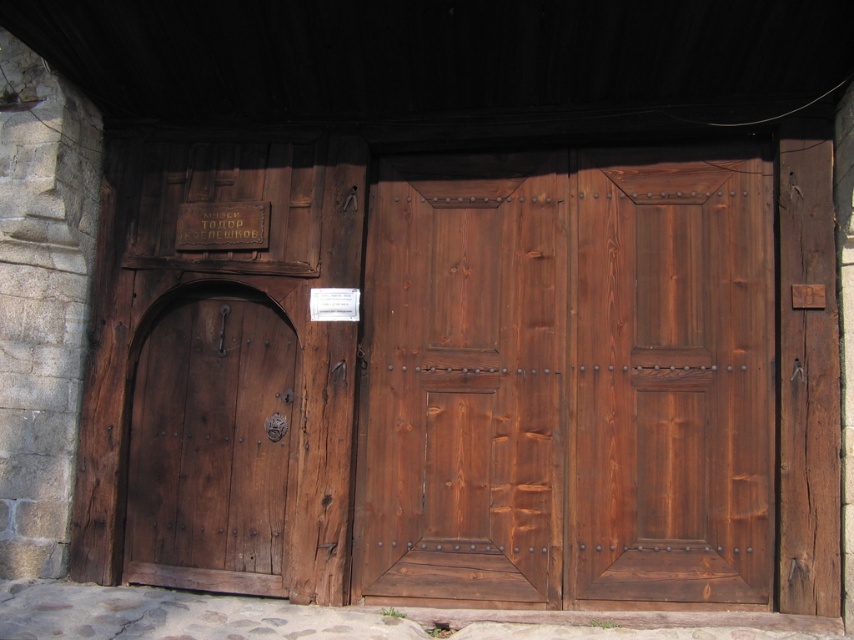
Which is behind, point (568, 260) or point (197, 516)?

Point (197, 516)

Where is `stained wood door at center`? stained wood door at center is located at coordinates (568, 380).

Is satin brown wood door at center positioned at the back of satin wood door at center?

No, it is not.

Does satin brown wood door at center have a greater width compared to satin wood door at center?

Incorrect, satin brown wood door at center's width does not surpass satin wood door at center's.

Measure the distance between satin brown wood door at center and camera.

satin brown wood door at center is 4.17 meters from camera.

The height and width of the screenshot is (640, 854). What are the coordinates of `satin brown wood door at center` in the screenshot? It's located at (671, 378).

Is satin brown wood door at center wider than dark brown wood door at left?

Indeed, satin brown wood door at center has a greater width compared to dark brown wood door at left.

Is satin brown wood door at center closer to camera compared to dark brown wood door at left?

Yes, it is.

This screenshot has width=854, height=640. In order to click on satin brown wood door at center in this screenshot , I will do `click(671, 378)`.